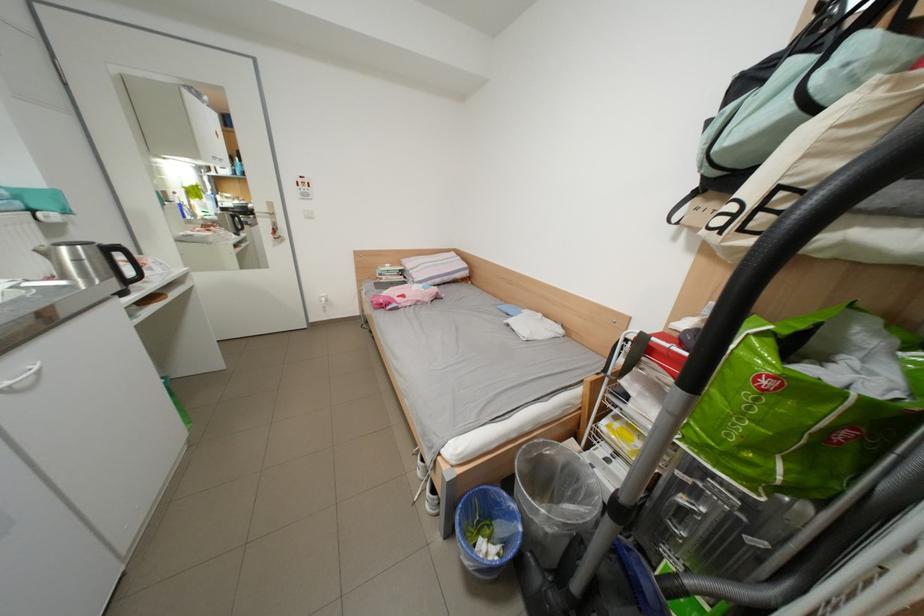
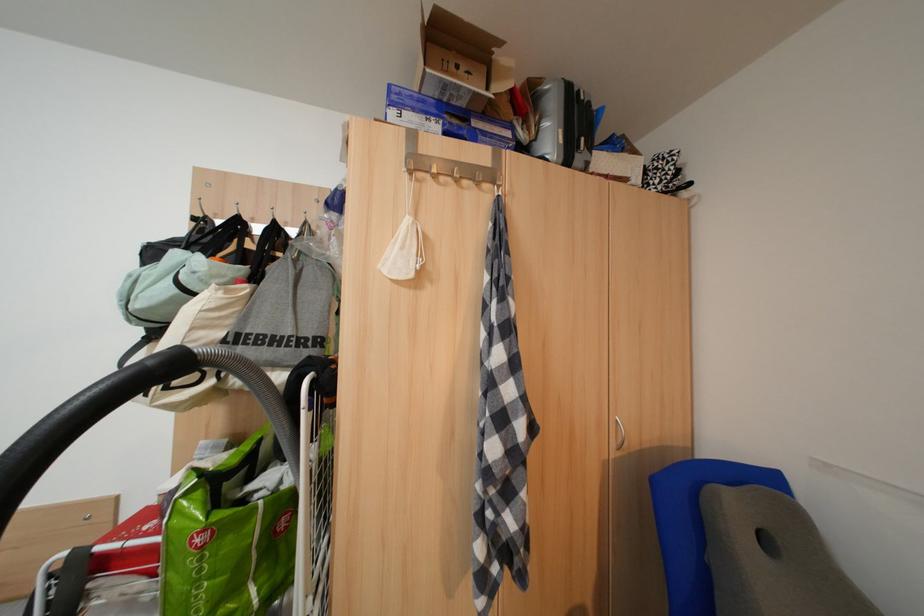
Find the pixel in the second image that matches the point at 754,448 in the first image.

(225, 610)